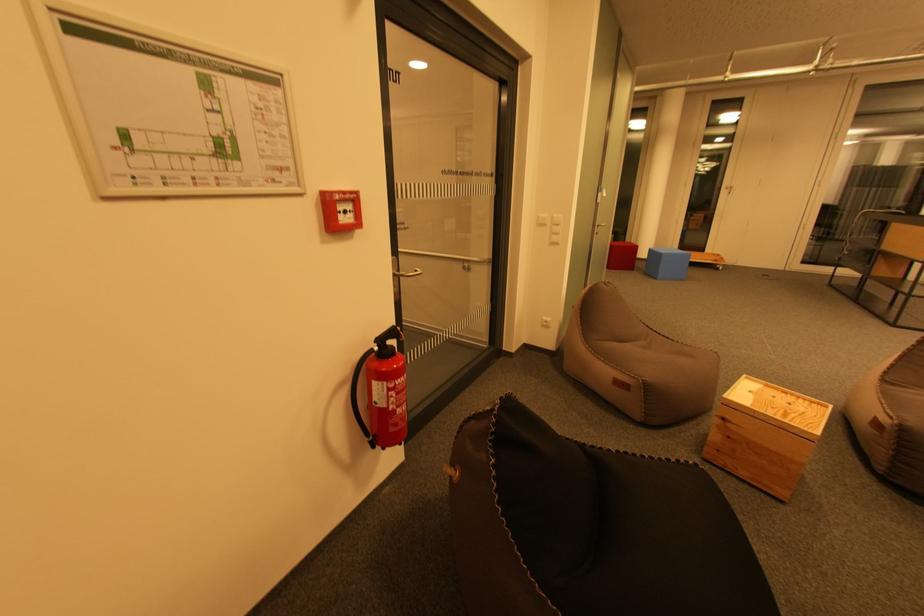
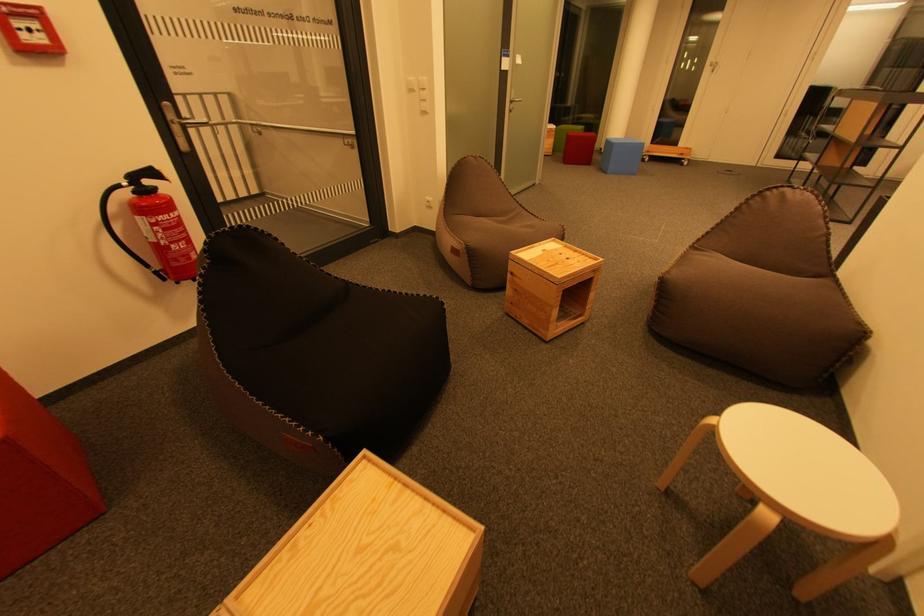
Question: Which direction would the cameraman need to move to produce the second image? Reply with the corresponding letter.

Choices:
 (A) Left
 (B) Right
 (C) Forward
 (D) Backward

Answer: (B)